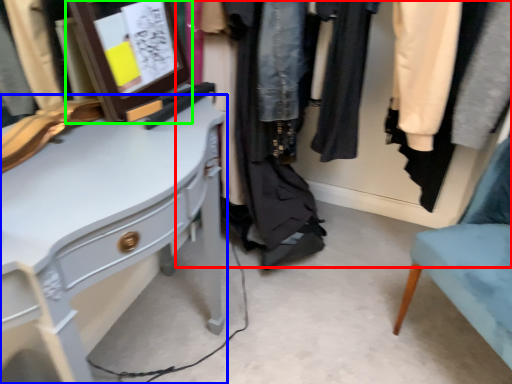
Question: Based on their relative distances, which object is nearer to closet (highlighted by a red box)? Choose from desk (highlighted by a blue box) and picture frame (highlighted by a green box).

Choices:
 (A) desk
 (B) picture frame

Answer: (B)